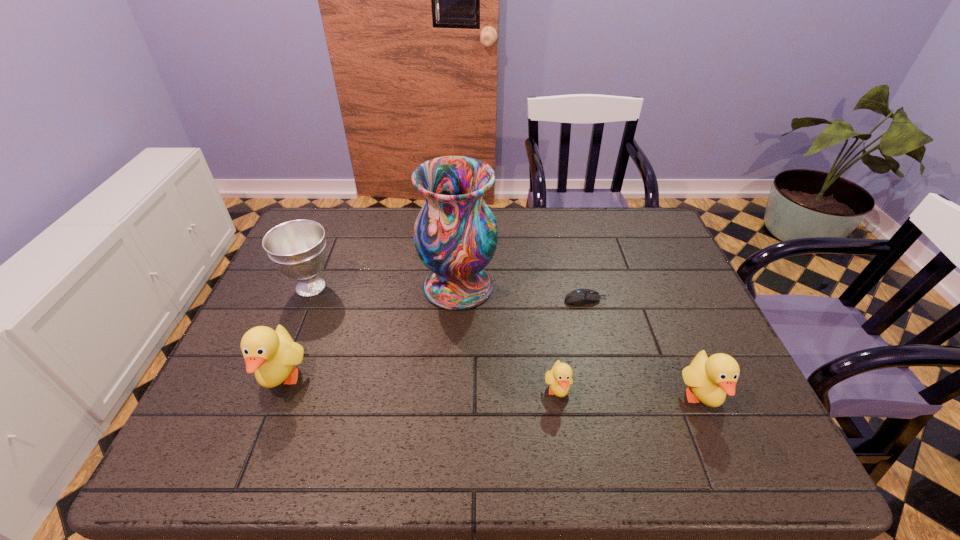
Please point a location where one more duckling can be added evenly. Please provide its 2D coordinates. Your answer should be formatted as a tuple, i.e. [(x, y)], where the tuple contains the x and y coordinates of a point satisfying the conditions above.

[(419, 386)]